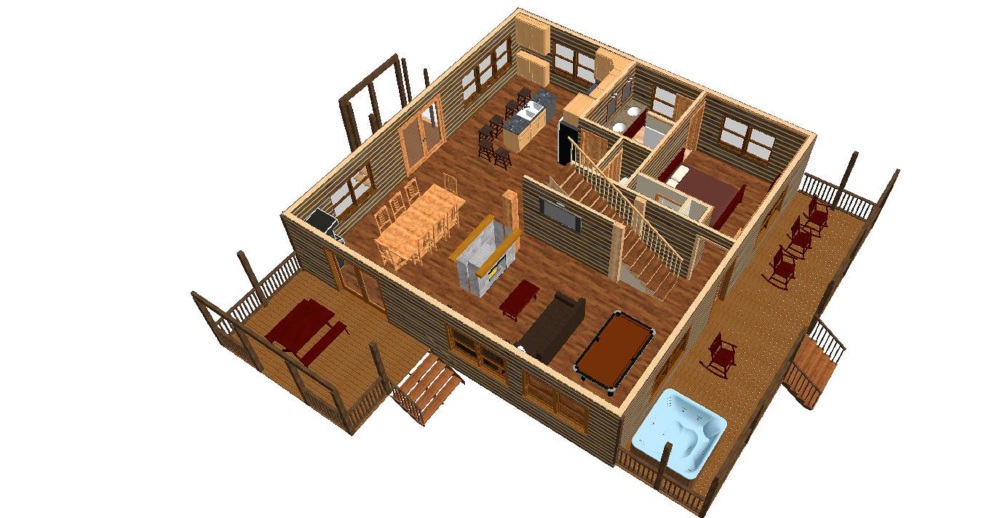
I want to click on dining room fireplace, so click(472, 244).